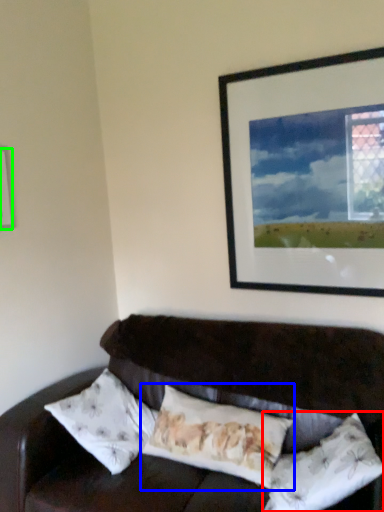
Question: Which object is the farthest from pillow (highlighted by a red box)? Choose among these: pillow (highlighted by a blue box) or picture frame (highlighted by a green box).

Choices:
 (A) pillow
 (B) picture frame

Answer: (B)